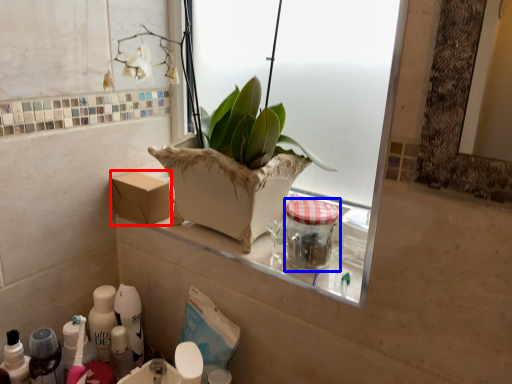
Question: Among these objects, which one is farthest to the camera, cardboard box (highlighted by a red box) or glass jar (highlighted by a blue box)?

Choices:
 (A) cardboard box
 (B) glass jar

Answer: (A)